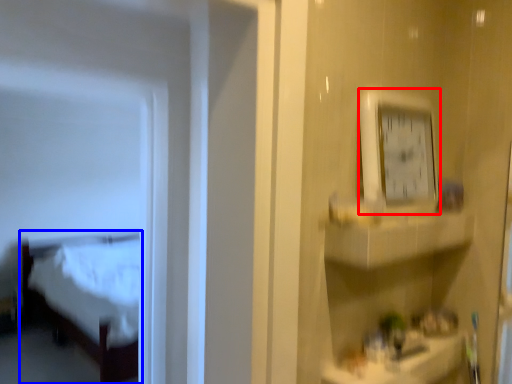
Question: Which of the following is the farthest to the observer, clock (highlighted by a red box) or furniture (highlighted by a blue box)?

Choices:
 (A) clock
 (B) furniture

Answer: (B)